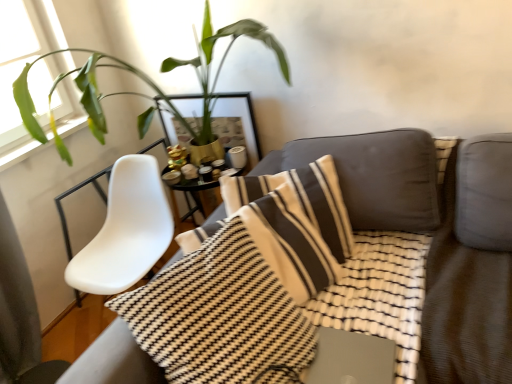
Question: Considering their positions, is textured gray couch at center located in front of or behind green leafy plant at upper left?

Choices:
 (A) front
 (B) behind

Answer: (A)

Question: From a real-world perspective, is textured gray couch at center positioned above or below green leafy plant at upper left?

Choices:
 (A) above
 (B) below

Answer: (B)

Question: Estimate the real-world distances between objects in this image. Which object is closer to the green leafy plant at upper left?

Choices:
 (A) textured gray couch at center
 (B) gold metallic picture frame at upper center
 (C) metallic silver laptop at center

Answer: (B)

Question: Based on their relative distances, which object is farther from the metallic silver laptop at center?

Choices:
 (A) textured gray couch at center
 (B) green leafy plant at upper left
 (C) gold metallic picture frame at upper center

Answer: (B)